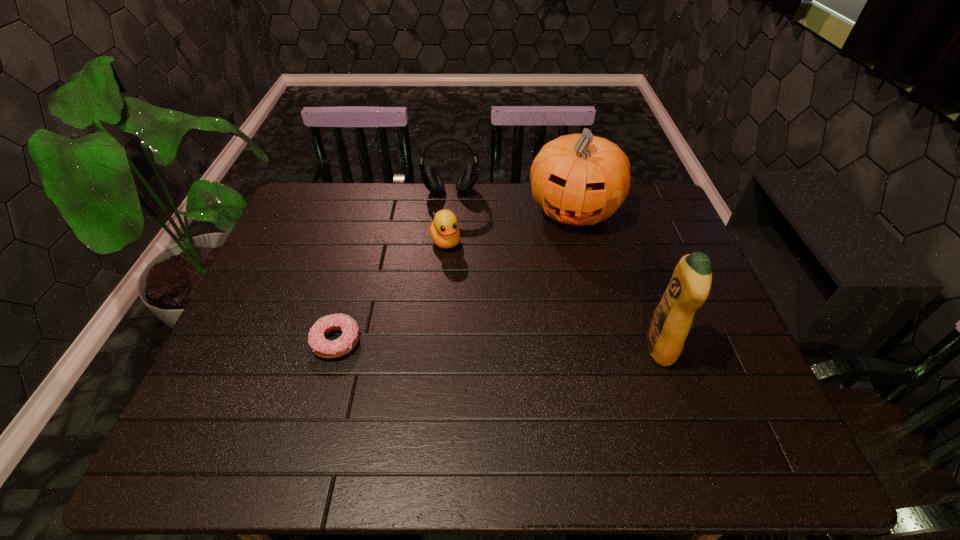
Where is `pumpkin at the far edge`? The width and height of the screenshot is (960, 540). pumpkin at the far edge is located at coordinates (579, 179).

Locate an element on the screen. This screenshot has width=960, height=540. detergent at the right edge is located at coordinates (689, 287).

Identify the location of pumpkin located at the right edge. (579, 179).

Image resolution: width=960 pixels, height=540 pixels. Identify the location of object present at the far right corner. (579, 179).

This screenshot has height=540, width=960. I want to click on vacant space at the far edge of the desktop, so click(409, 186).

You are a GUI agent. You are given a task and a screenshot of the screen. Output one action in this format:
    pyautogui.click(x=<x>, y=<y>)
    Task: Click on the vacant area at the left edge of the desktop
    This screenshot has width=960, height=540.
    Given the screenshot: What is the action you would take?
    pyautogui.click(x=281, y=268)

Image resolution: width=960 pixels, height=540 pixels. Find the location of `vacant space at the right edge`. vacant space at the right edge is located at coordinates (659, 255).

Identify the location of free region at the far left corner of the desktop. This screenshot has height=540, width=960. (327, 222).

Find the location of a particular element. This screenshot has width=960, height=540. free space between the pumpkin and the second shortest object is located at coordinates (510, 226).

Where is `free space between the leftmost object and the detergent`? This screenshot has height=540, width=960. free space between the leftmost object and the detergent is located at coordinates (498, 344).